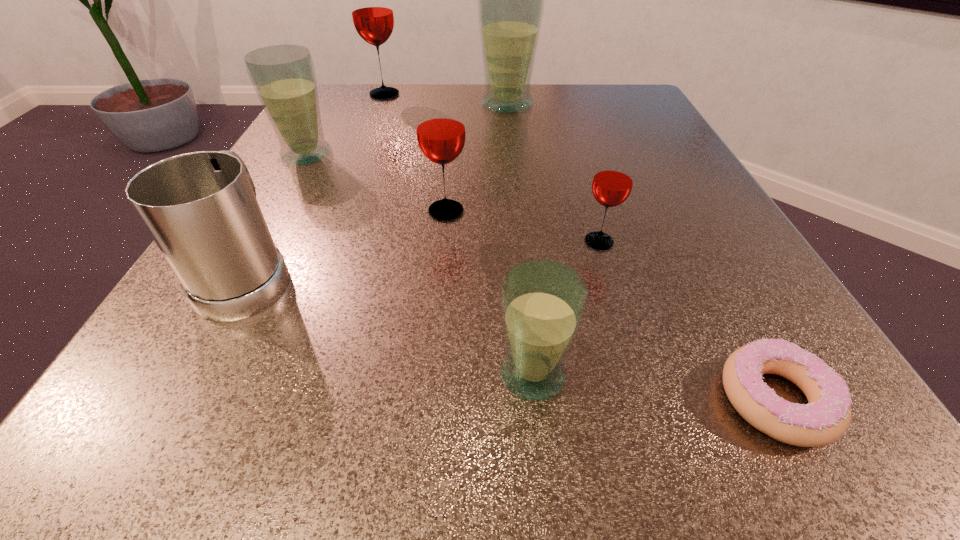
What are the coordinates of `blank region between the rightmost red glass and the second farthest blue glass` in the screenshot? It's located at (453, 198).

Identify the location of unoccupied area between the mug and the second smallest red glass. This screenshot has width=960, height=540. (348, 242).

Where is `free space between the nearest red glass and the pink doughnut`? free space between the nearest red glass and the pink doughnut is located at coordinates (687, 321).

Locate an element on the screen. This screenshot has width=960, height=540. free space between the biggest blue glass and the fifth object from right to left is located at coordinates (476, 158).

At what (x,y) coordinates should I click in order to perform the action: click on blank region between the second red glass from left to right and the mug. Please return your answer as a coordinate pair (x, y). The height and width of the screenshot is (540, 960). Looking at the image, I should click on (348, 242).

This screenshot has height=540, width=960. Find the location of `vacant area between the nearest blue glass and the farthest blue glass`. vacant area between the nearest blue glass and the farthest blue glass is located at coordinates (519, 239).

You are a GUI agent. You are given a task and a screenshot of the screen. Output one action in this format:
    pyautogui.click(x=<x>, y=<y>)
    Task: Click on the sixth closest object to the second object from right to left
    This screenshot has height=540, width=960.
    Given the screenshot: What is the action you would take?
    pyautogui.click(x=283, y=76)

At what (x,y) coordinates should I click in order to perform the action: click on object that stands as the fifth closest to the biggest blue glass. Please return your answer as a coordinate pair (x, y). The image size is (960, 540). Looking at the image, I should click on (200, 208).

Point out which glass is positioned as the second nearest to the third farthest glass. Please provide its 2D coordinates. Your answer should be formatted as a tuple, i.e. [(x, y)], where the tuple contains the x and y coordinates of a point satisfying the conditions above.

[(440, 126)]

Choose which glass is the nearest neighbor to the second nearest blue glass. Please provide its 2D coordinates. Your answer should be formatted as a tuple, i.e. [(x, y)], where the tuple contains the x and y coordinates of a point satisfying the conditions above.

[(372, 13)]